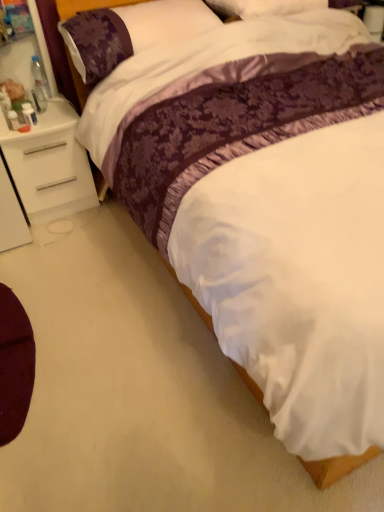
Question: Is maroon fabric cushion at lower left wider or thinner than white matte nightstand at left?

Choices:
 (A) thin
 (B) wide

Answer: (A)

Question: In terms of height, does maroon fabric cushion at lower left look taller or shorter compared to white matte nightstand at left?

Choices:
 (A) short
 (B) tall

Answer: (A)

Question: Estimate the real-world distances between objects in this image. Which object is closer to the plush brown bear at left?

Choices:
 (A) purple satin pillow at upper left
 (B) white matte nightstand at left
 (C) maroon fabric cushion at lower left

Answer: (B)

Question: Considering the real-world distances, which object is closest to the plush brown bear at left?

Choices:
 (A) white matte nightstand at left
 (B) maroon fabric cushion at lower left
 (C) purple satin pillow at upper left

Answer: (A)